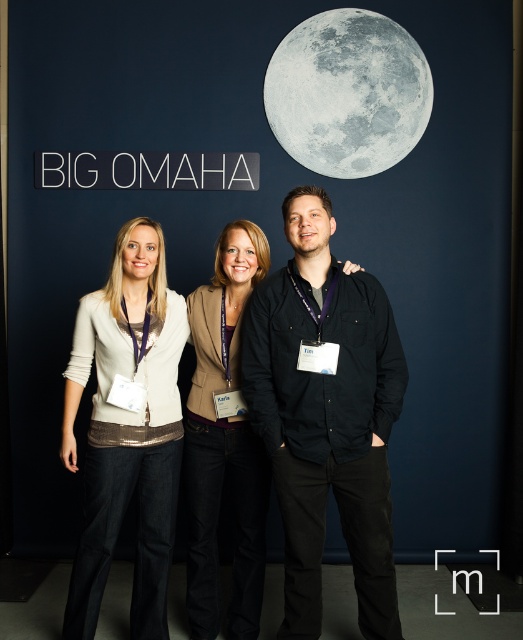
You are a photographer setting up for a group photo. You need to ensure that the matte brown blazer at center and the gray matte moon at upper center are both visible in the frame. Based on their positions, which object will appear larger in the photo?

The matte brown blazer at center will appear larger in the photo because it is closer to the viewer than the gray matte moon at upper center.

You are standing in front of the BIG OMAHA backdrop and need to place a matte white sweater at center exactly at the coordinates given. Where should you position it?

The matte white sweater at center should be positioned at the 2D coordinates point (127,429) as specified.

You are standing in front of the BIG OMAHA backdrop and notice two points marked on the image. Which point, point [73,378] or point [196,605], is closer to you?

Point [73,378] is closer to the viewer than point [196,605].